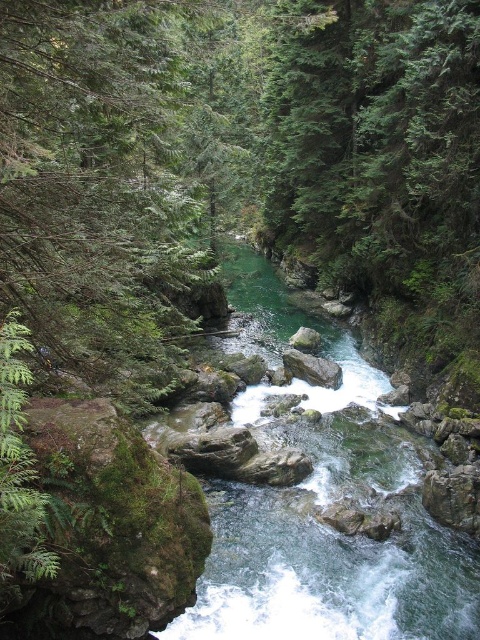
You are planning to cross the river at the green smooth water at center. Based on the coordinates provided, is this the best spot to cross if you want to stay as close to the center of the image as possible?

The green smooth water at center is located at point (327,577), which is closer to the right side of the image rather than the exact center. Therefore, it might not be the best spot if you want to stay as close to the center of the image as possible.

You are a hiker trying to cross the river at the center of the valley. You see the green smooth water at center and the gray rock at center. Which one should you step on to avoid getting wet?

You should step on the gray rock at center because it is positioned to the right of the green smooth water at center, making it a solid surface above the water.